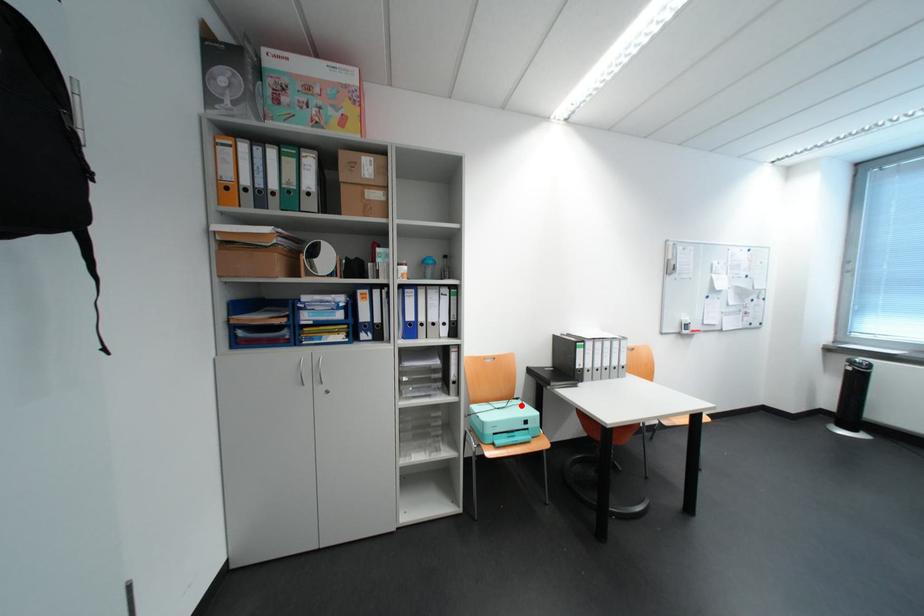
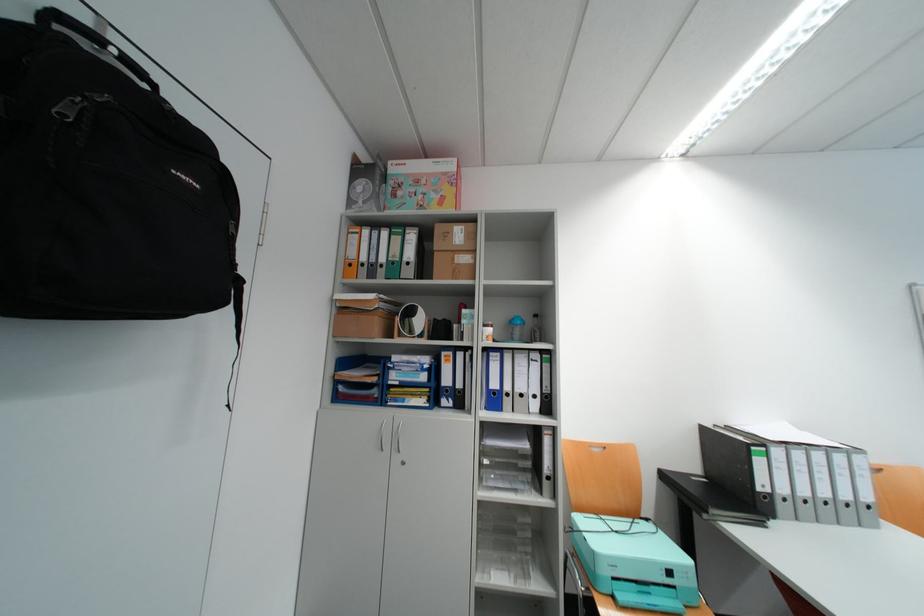
Where in the second image is the point corresponding to the highlighted location from the first image?

(648, 529)